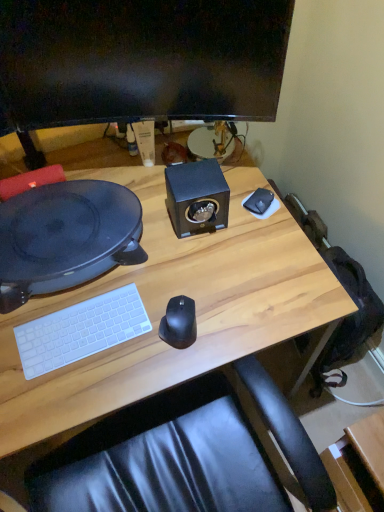
The height and width of the screenshot is (512, 384). Find the location of `empty space that is ontop of wooden desk at center (from a real-world perspective)`. empty space that is ontop of wooden desk at center (from a real-world perspective) is located at coordinates (130, 272).